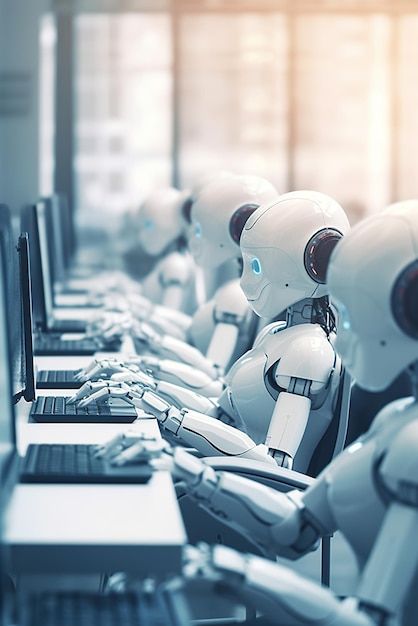
Find the location of a particular element. windows is located at coordinates (125, 88), (232, 86), (331, 88), (407, 91).